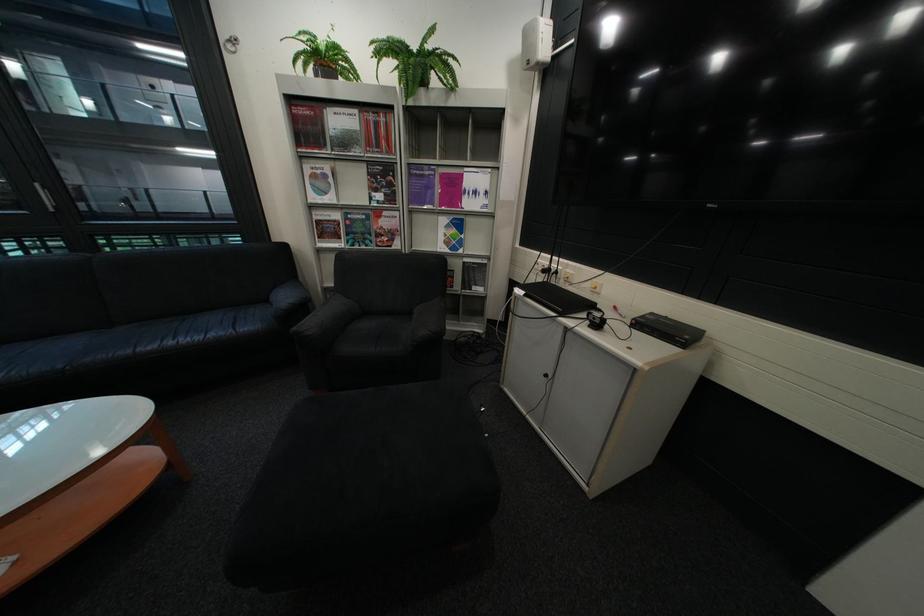
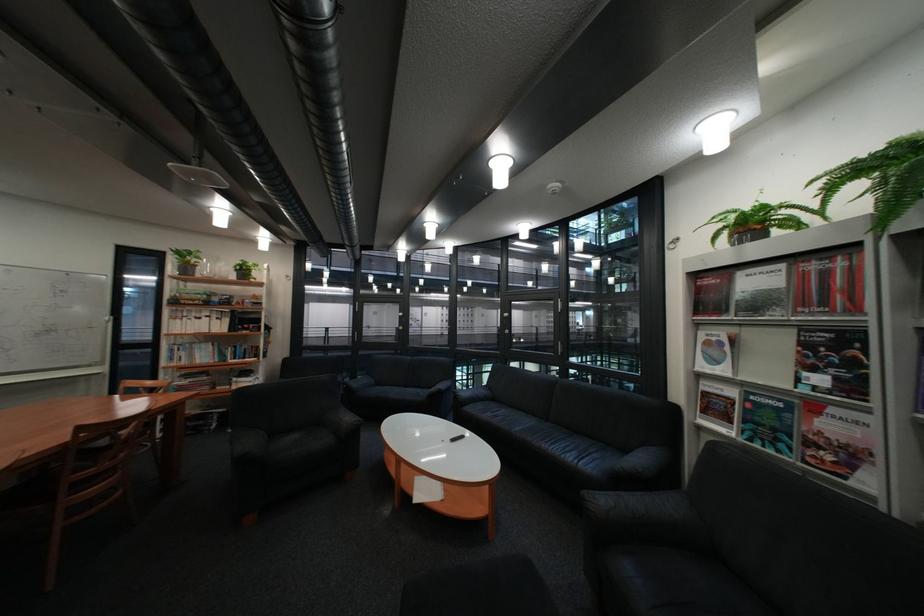
Question: Based on the continuous images, in which direction is the camera rotating? Reply with the corresponding letter.

Choices:
 (A) Left
 (B) Right
 (C) Up
 (D) Down

Answer: (A)